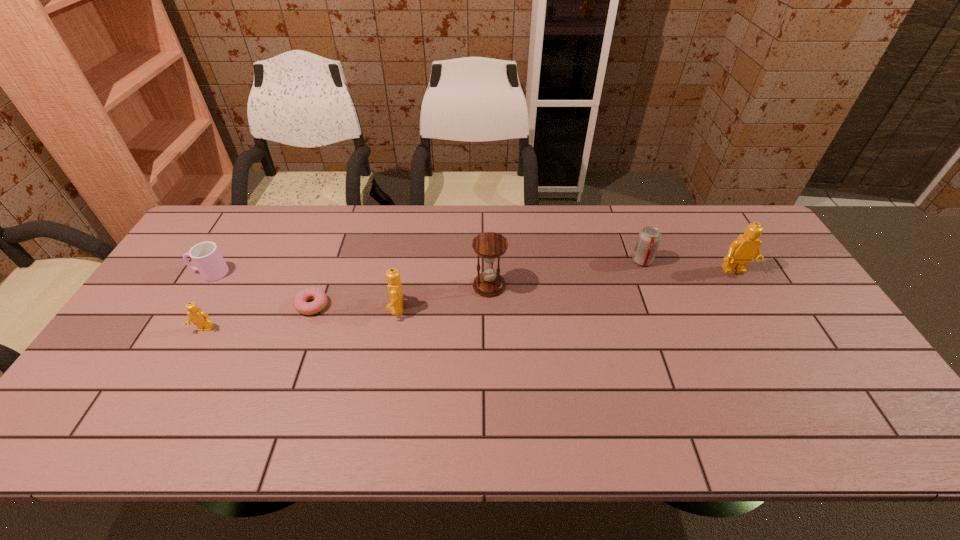
To ensure equal spacing by inserting another Lego among them, please point out a vacant spot for this new Lego. Please provide its 2D coordinates. Your answer should be formatted as a tuple, i.e. [(x, y)], where the tuple contains the x and y coordinates of a point satisfying the conditions above.

[(572, 289)]